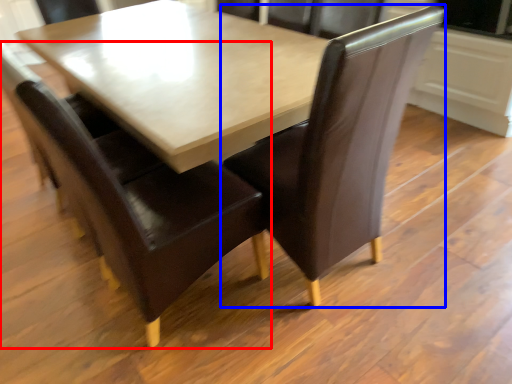
Question: Which object is closer to the camera taking this photo, chair (highlighted by a red box) or chair (highlighted by a blue box)?

Choices:
 (A) chair
 (B) chair

Answer: (A)